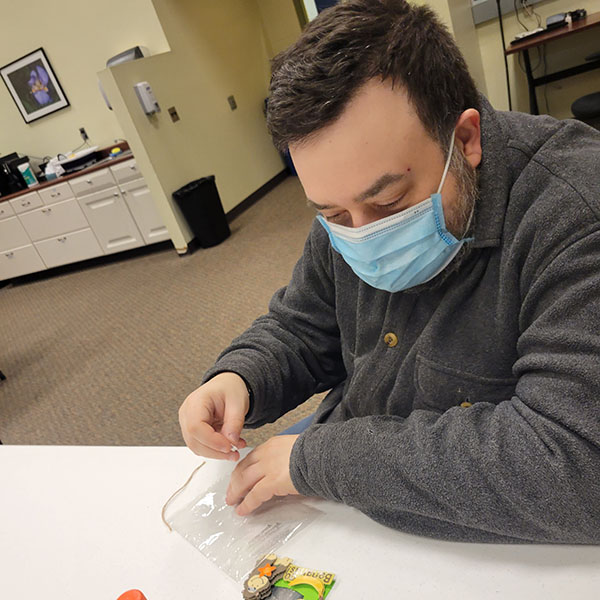
The width and height of the screenshot is (600, 600). What are the coordinates of `bin` in the screenshot? It's located at (208, 218).